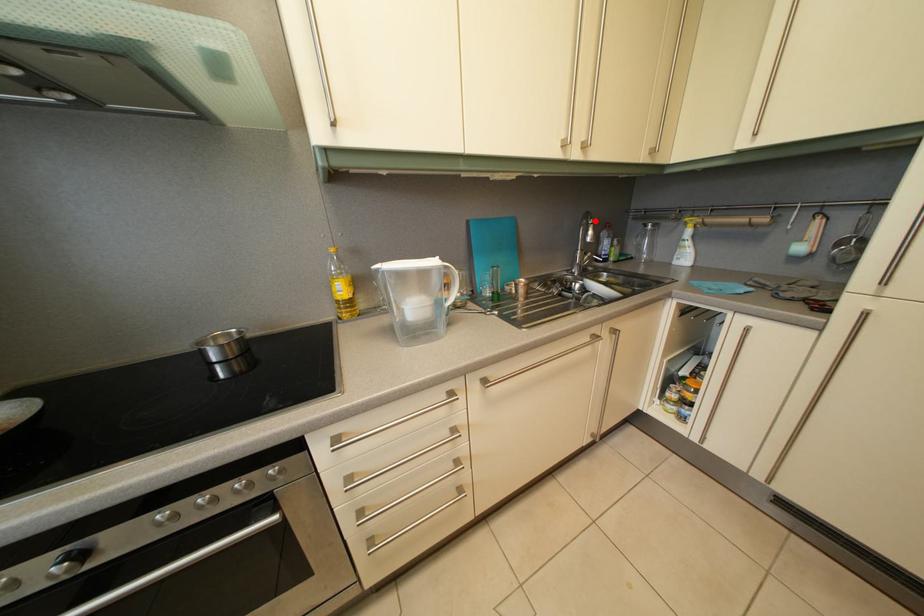
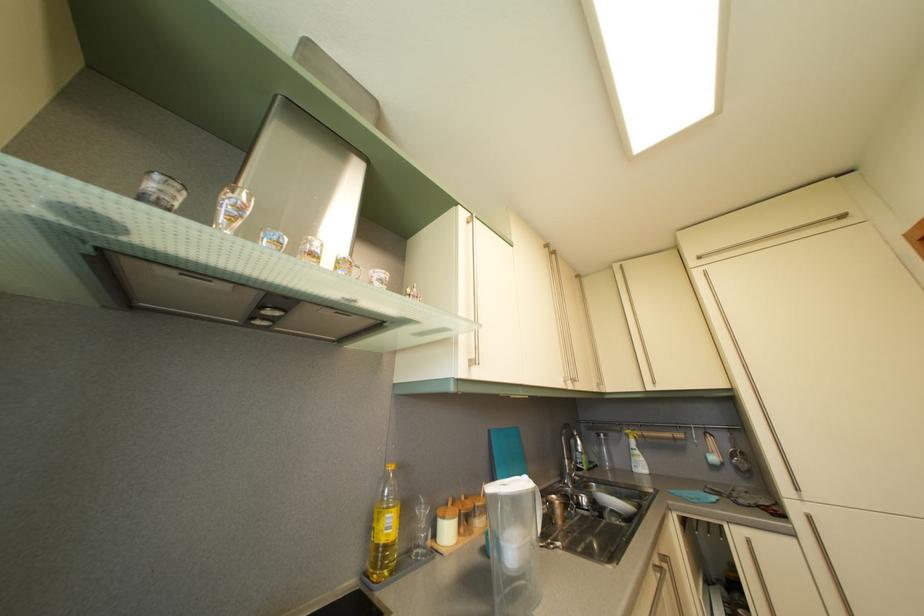
Question: I am providing you with two images of the same scene from different viewpoints. In image1, a red point is highlighted. Considering the same 3D point in image2, which of the following is correct?

Choices:
 (A) It is closer
 (B) It is farther

Answer: (B)